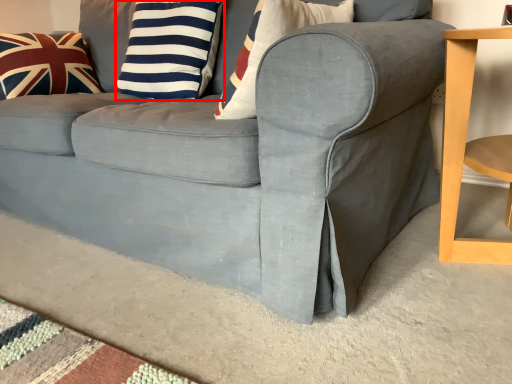
Question: From the image, what is the correct spatial relationship of pillow (annotated by the red box) in relation to pillow?

Choices:
 (A) left
 (B) right

Answer: (B)